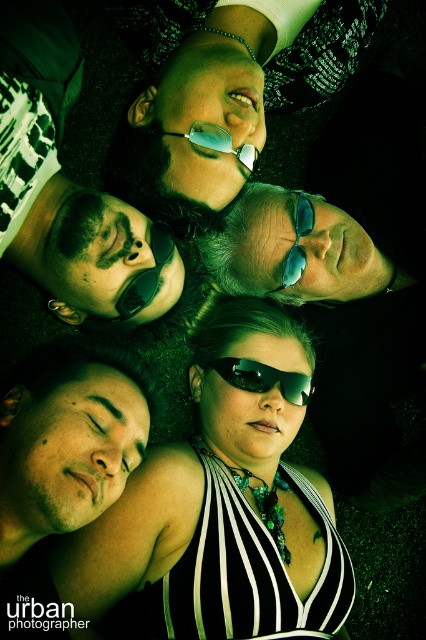
You are standing in front of the image and want to know how far the matte black sunglasses at upper left are from you. Can you determine the distance?

The matte black sunglasses at upper left is 34.74 inches from the viewer.

You are a photographer trying to focus on the black striped tank top at center. Based on the coordinates provided, where exactly should you adjust your camera to capture it?

The black striped tank top at center is located at coordinates point (222, 502), so adjust your camera to that exact point to capture it.

You are standing at the center of the star formation made by the five people lying down. You want to move towards the edge of the formation. Which point, point (184,557) or point (296,268), is closer to you?

Point (184,557) is closer to you because it is in front of point (296,268).